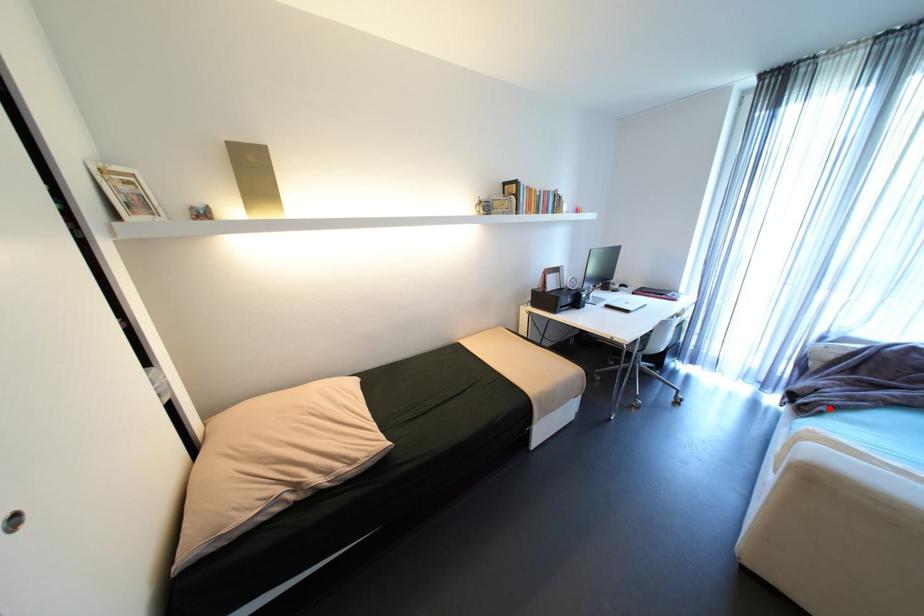
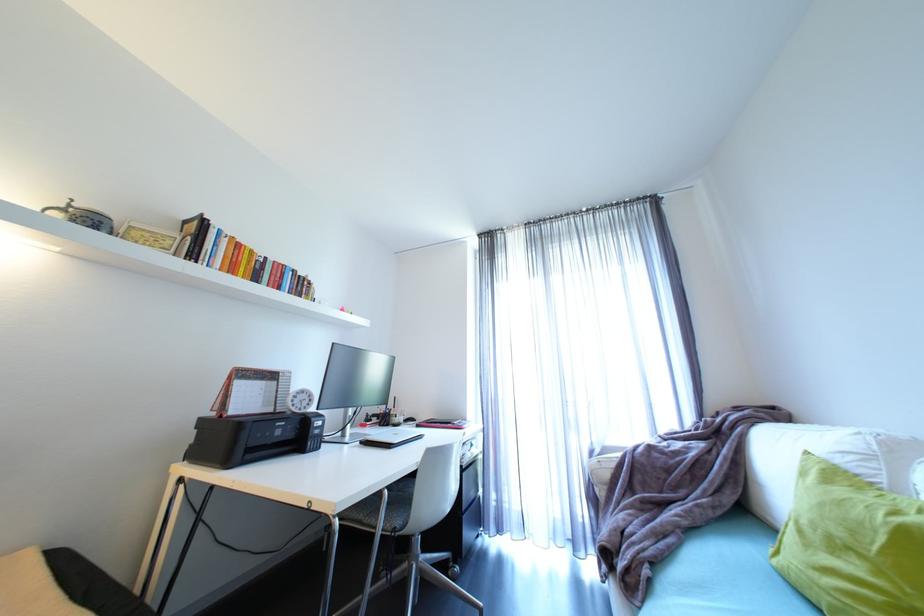
The point at the highlighted location is marked in the first image. Where is the corresponding point in the second image?

(653, 572)